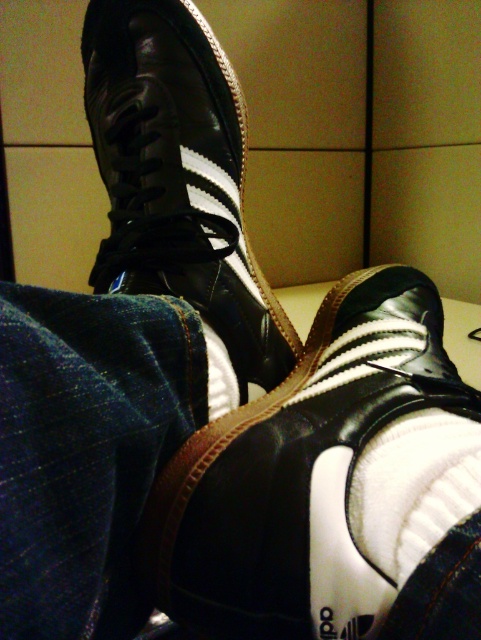
Question: Which object appears farthest from the camera in this image?

Choices:
 (A) black leather shoe at upper center
 (B) white fluffy sock at center

Answer: (A)

Question: Is black leather shoe at center above black leather shoe at upper center?

Choices:
 (A) no
 (B) yes

Answer: (A)

Question: Does black leather shoe at upper center have a larger size compared to white fluffy sock at center?

Choices:
 (A) yes
 (B) no

Answer: (A)

Question: Is black leather shoe at center positioned behind black leather shoe at upper center?

Choices:
 (A) yes
 (B) no

Answer: (B)

Question: Which point is farther from the camera taking this photo?

Choices:
 (A) (370, 451)
 (B) (249, 529)

Answer: (A)

Question: Which point appears closest to the camera in this image?

Choices:
 (A) (203, 72)
 (B) (235, 611)
 (C) (432, 472)

Answer: (B)